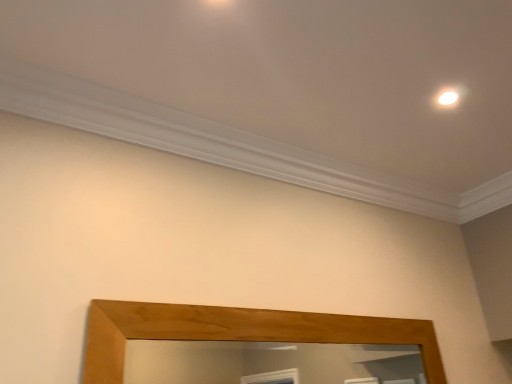
Image resolution: width=512 pixels, height=384 pixels. Describe the element at coordinates (237, 331) in the screenshot. I see `light brown wood picture frame at lower center` at that location.

Where is `light brown wood picture frame at lower center`? light brown wood picture frame at lower center is located at coordinates (237, 331).

In order to click on light brown wood picture frame at lower center in this screenshot , I will do `click(237, 331)`.